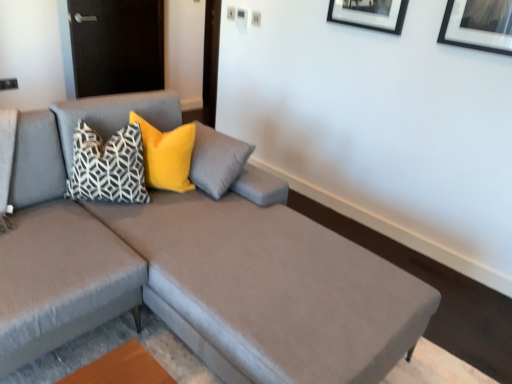
Question: Is textured gray couch at center closer to the viewer compared to geometric-patterned fabric pillow at center, the first pillow from the left?

Choices:
 (A) no
 (B) yes

Answer: (B)

Question: From a real-world perspective, is textured gray couch at center below geometric-patterned fabric pillow at center, the first pillow from the left?

Choices:
 (A) yes
 (B) no

Answer: (A)

Question: Is textured gray couch at center taller than geometric-patterned fabric pillow at center, the second pillow in the right-to-left sequence?

Choices:
 (A) yes
 (B) no

Answer: (A)

Question: Is geometric-patterned fabric pillow at center, the second pillow in the right-to-left sequence, at the back of textured gray couch at center?

Choices:
 (A) no
 (B) yes

Answer: (A)

Question: Is textured gray couch at center next to geometric-patterned fabric pillow at center, the second pillow in the right-to-left sequence?

Choices:
 (A) no
 (B) yes

Answer: (A)

Question: Is velvet yellow pillow at upper left, arranged as the first pillow when viewed from the right, situated inside textured gray couch at center or outside?

Choices:
 (A) outside
 (B) inside

Answer: (B)

Question: Considering the positions of velvet yellow pillow at upper left, arranged as the first pillow when viewed from the right, and textured gray couch at center in the image, is velvet yellow pillow at upper left, arranged as the first pillow when viewed from the right, wider or thinner than textured gray couch at center?

Choices:
 (A) wide
 (B) thin

Answer: (B)

Question: Does point click(164, 144) appear closer or farther from the camera than point click(374, 327)?

Choices:
 (A) closer
 (B) farther

Answer: (B)

Question: From a real-world perspective, is velvet yellow pillow at upper left, arranged as the first pillow when viewed from the right, above or below textured gray couch at center?

Choices:
 (A) above
 (B) below

Answer: (A)

Question: From the image's perspective, is velvet yellow pillow at upper left, which is the 2th pillow in left-to-right order, positioned above or below geometric-patterned fabric pillow at center, the first pillow from the left?

Choices:
 (A) below
 (B) above

Answer: (B)

Question: Looking at the image, does velvet yellow pillow at upper left, which is the 2th pillow in left-to-right order, seem bigger or smaller compared to geometric-patterned fabric pillow at center, the first pillow from the left?

Choices:
 (A) small
 (B) big

Answer: (A)

Question: Looking at their shapes, would you say velvet yellow pillow at upper left, which is the 2th pillow in left-to-right order, is wider or thinner than geometric-patterned fabric pillow at center, the first pillow from the left?

Choices:
 (A) wide
 (B) thin

Answer: (B)

Question: Is point (148, 139) closer or farther from the camera than point (111, 150)?

Choices:
 (A) closer
 (B) farther

Answer: (B)

Question: Considering the positions of textured gray couch at center and geometric-patterned fabric pillow at center, the second pillow in the right-to-left sequence, in the image, is textured gray couch at center taller or shorter than geometric-patterned fabric pillow at center, the second pillow in the right-to-left sequence,?

Choices:
 (A) short
 (B) tall

Answer: (B)

Question: Considering their positions, is textured gray couch at center located in front of or behind geometric-patterned fabric pillow at center, the second pillow in the right-to-left sequence?

Choices:
 (A) front
 (B) behind

Answer: (A)